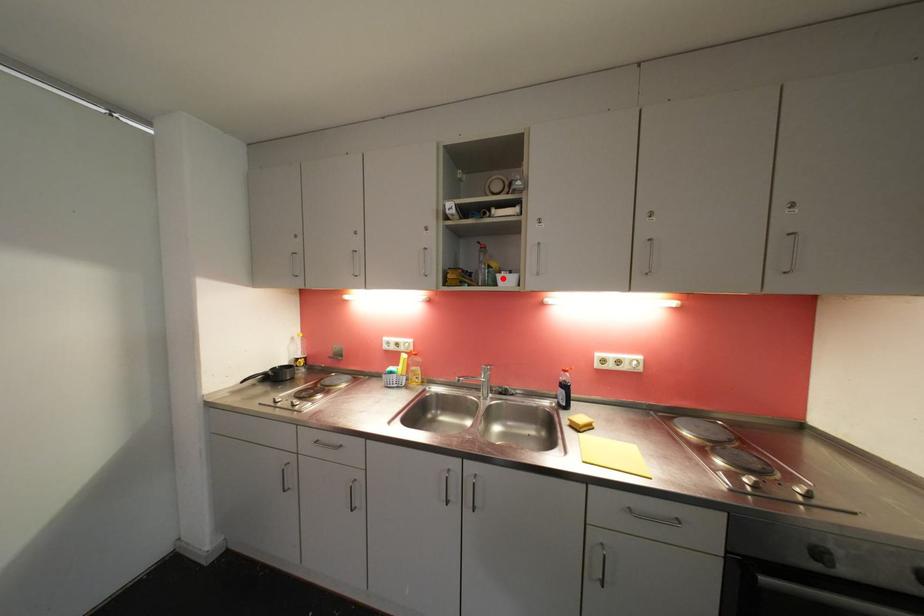
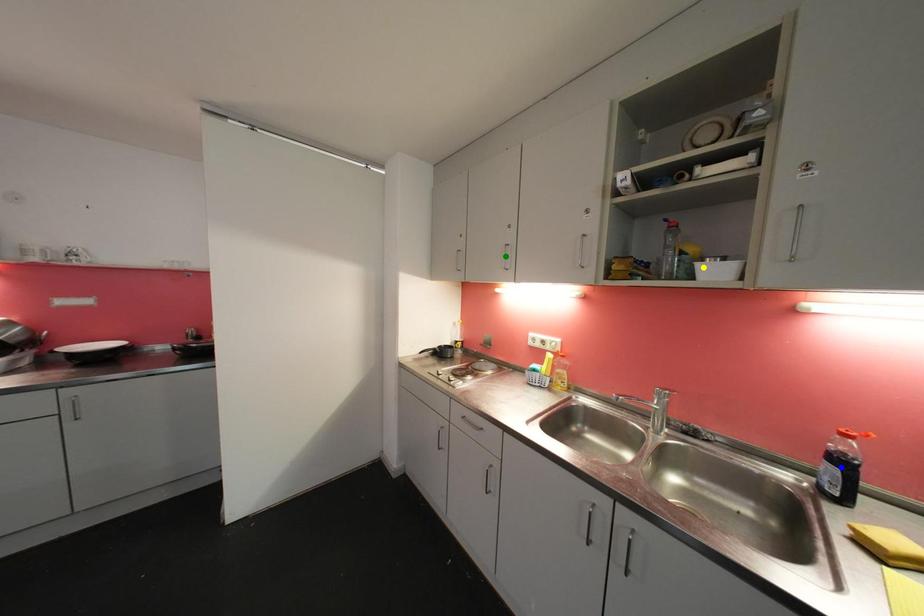
Question: I am providing you with two images of the same scene from different viewpoints. A red point is marked on the first image. You are given multiple points on the second image. Which mark in image 2 goes with the point in image 1?

Choices:
 (A) green point
 (B) blue point
 (C) yellow point

Answer: (C)